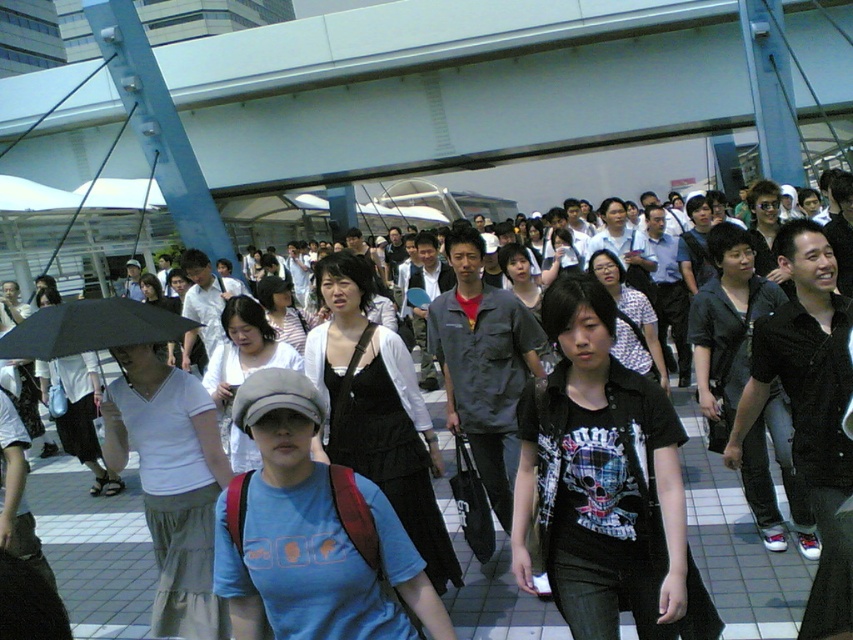
Question: Which point is closer to the camera?

Choices:
 (A) matte black dress at center
 (B) black matte umbrella at left

Answer: (B)

Question: Is matte black dress at center below black matte umbrella at left?

Choices:
 (A) no
 (B) yes

Answer: (B)

Question: Which point is closer to the camera?

Choices:
 (A) matte black dress at center
 (B) black matte umbrella at left

Answer: (B)

Question: Does matte black dress at center lie in front of black matte umbrella at left?

Choices:
 (A) yes
 (B) no

Answer: (B)

Question: Which point appears farthest from the camera in this image?

Choices:
 (A) (109, 339)
 (B) (724, 576)

Answer: (B)

Question: Is matte black dress at center wider than black matte umbrella at left?

Choices:
 (A) yes
 (B) no

Answer: (B)